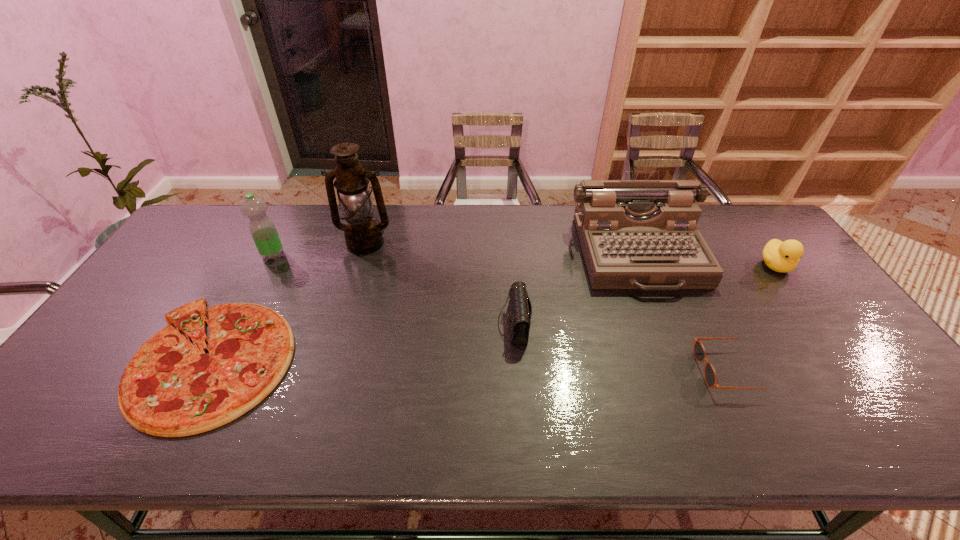
Where is `the third object from left to right`? This screenshot has height=540, width=960. the third object from left to right is located at coordinates (363, 235).

The height and width of the screenshot is (540, 960). In order to click on oil lamp in this screenshot , I will do `click(363, 235)`.

Find the location of a particular element. This screenshot has height=540, width=960. water bottle is located at coordinates (263, 231).

This screenshot has height=540, width=960. In order to click on typewriter in this screenshot , I will do `click(635, 234)`.

This screenshot has width=960, height=540. Identify the location of the rightmost object. (782, 257).

In order to click on duck in this screenshot , I will do `click(782, 257)`.

Identify the location of the third shortest object. (520, 309).

The image size is (960, 540). What are the coordinates of `clutch bag` in the screenshot? It's located at (520, 309).

What are the coordinates of `sunglasses` in the screenshot? It's located at (699, 352).

The image size is (960, 540). Find the location of `pizza`. pizza is located at coordinates (170, 388).